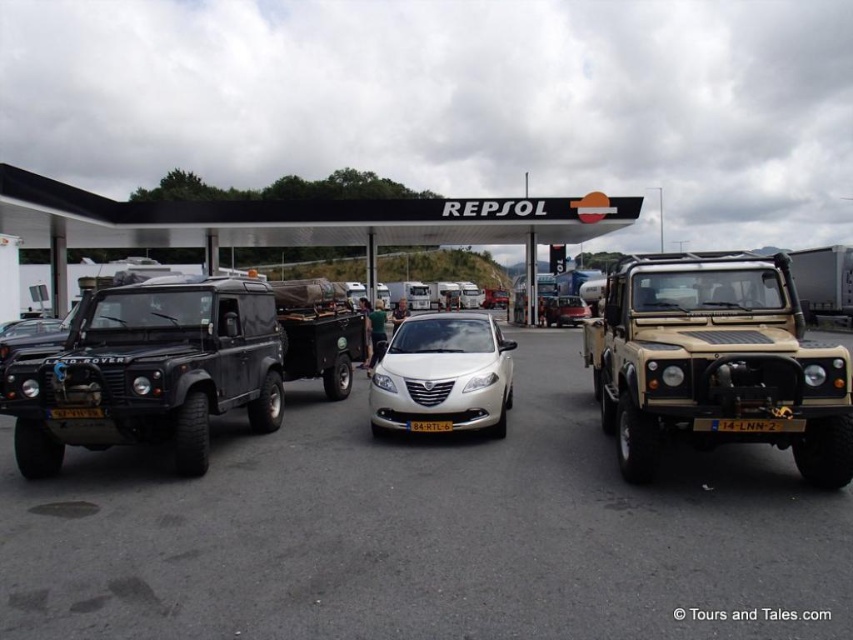
Question: Is black plastic license plate at center closer to the viewer compared to yellow matte license plate at center?

Choices:
 (A) yes
 (B) no

Answer: (A)

Question: From the image, what is the correct spatial relationship of matte black suv at left in relation to yellow matte license plate at center?

Choices:
 (A) below
 (B) above

Answer: (B)

Question: Estimate the real-world distances between objects in this image. Which object is closer to the matte black suv at left?

Choices:
 (A) black plastic license plate at center
 (B) yellow matte license plate at center
 (C) black metal/glass canopy at center
 (D) tan matte/sand textured suv at right

Answer: (A)

Question: Which object is farther from the camera taking this photo?

Choices:
 (A) black metal/glass canopy at center
 (B) tan matte/sand textured suv at right
 (C) black plastic license plate at center

Answer: (A)

Question: Which point appears farthest from the camera in this image?

Choices:
 (A) (474, 401)
 (B) (434, 426)

Answer: (B)

Question: Is black metal/glass canopy at center further to camera compared to yellow matte license plate at center?

Choices:
 (A) yes
 (B) no

Answer: (A)